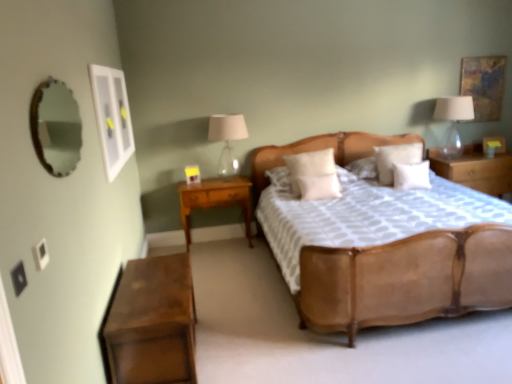
Where is `vacant location below light wood/wooden nightstand at lower left, the second nightstand when ordered from right to left (from a real-world perspective)`? The height and width of the screenshot is (384, 512). vacant location below light wood/wooden nightstand at lower left, the second nightstand when ordered from right to left (from a real-world perspective) is located at coordinates (216, 244).